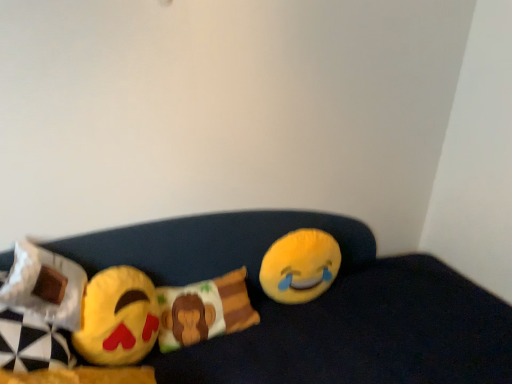
What do you see at coordinates (316, 306) in the screenshot? The image size is (512, 384). I see `yellow plush emoji at center` at bounding box center [316, 306].

What is the approximate height of matte yellow emoji at left, which appears as the 1th toy when viewed from the front?

matte yellow emoji at left, which appears as the 1th toy when viewed from the front, is 9.68 inches in height.

What is the approximate height of yellow plush at right, the 1th toy viewed from the right?

29.37 centimeters.

This screenshot has width=512, height=384. Describe the element at coordinates (204, 310) in the screenshot. I see `fluffy cotton pillow with monkey design at center, which ranks as the second pillow in left-to-right order` at that location.

Where is `white fabric pillow at left, positioned as the second pillow in right-to-left order`? white fabric pillow at left, positioned as the second pillow in right-to-left order is located at coordinates coord(45,285).

At what (x,y) coordinates should I click in order to perform the action: click on yellow plush emoji at center. Please return your answer as a coordinate pair (x, y). The image size is (512, 384). Looking at the image, I should click on (316, 306).

How many degrees apart are the facing directions of matte yellow emoji at left, which is the first toy from left to right, and yellow plush at right, the second toy when ordered from front to back?

The angular difference between matte yellow emoji at left, which is the first toy from left to right, and yellow plush at right, the second toy when ordered from front to back, is 15.2 degrees.

Is matte yellow emoji at left, the 2th toy when ordered from right to left, touching yellow plush at right, the second toy when ordered from front to back?

No, matte yellow emoji at left, the 2th toy when ordered from right to left, is not making contact with yellow plush at right, the second toy when ordered from front to back.

From the image's perspective, which object appears higher, matte yellow emoji at left, acting as the 2th toy starting from the back, or yellow plush at right, positioned as the second toy in left-to-right order?

yellow plush at right, positioned as the second toy in left-to-right order, from the image's perspective.

From a real-world perspective, which is physically below, matte yellow emoji at left, which is the first toy from left to right, or yellow plush at right, the second toy when ordered from front to back?

yellow plush at right, the second toy when ordered from front to back, from a real-world perspective.

Which of these two, yellow plush at right, which ranks as the first toy in back-to-front order, or fluffy cotton pillow with monkey design at center, the 1th pillow when ordered from right to left, is smaller?

yellow plush at right, which ranks as the first toy in back-to-front order, is smaller.

In the scene shown: Relative to fluffy cotton pillow with monkey design at center, placed as the first pillow when sorted from back to front, is yellow plush at right, which ranks as the first toy in back-to-front order, in front or behind?

In the image, yellow plush at right, which ranks as the first toy in back-to-front order, appears behind fluffy cotton pillow with monkey design at center, placed as the first pillow when sorted from back to front.

From the picture: Considering the positions of objects yellow plush at right, which ranks as the first toy in back-to-front order, and fluffy cotton pillow with monkey design at center, placed as the first pillow when sorted from back to front, in the image provided, who is more to the left, yellow plush at right, which ranks as the first toy in back-to-front order, or fluffy cotton pillow with monkey design at center, placed as the first pillow when sorted from back to front,?

Positioned to the left is fluffy cotton pillow with monkey design at center, placed as the first pillow when sorted from back to front.

Which of these two, yellow plush at right, which ranks as the first toy in back-to-front order, or fluffy cotton pillow with monkey design at center, which appears as the second pillow when viewed from the front, is wider?

With larger width is fluffy cotton pillow with monkey design at center, which appears as the second pillow when viewed from the front.

Does matte yellow emoji at left, which is the first toy from left to right, come behind white fabric pillow at left, acting as the second pillow starting from the back?

Yes, matte yellow emoji at left, which is the first toy from left to right, is further from the camera.

How much distance is there between matte yellow emoji at left, which appears as the 1th toy when viewed from the front, and white fabric pillow at left, positioned as the second pillow in right-to-left order?

They are 4.46 inches apart.

Is matte yellow emoji at left, which appears as the 1th toy when viewed from the front, smaller than white fabric pillow at left, the 1th pillow viewed from the front?

Actually, matte yellow emoji at left, which appears as the 1th toy when viewed from the front, might be larger than white fabric pillow at left, the 1th pillow viewed from the front.

From a real-world perspective, is white fabric pillow at left, the first pillow viewed from the left, positioned over yellow plush emoji at center based on gravity?

Yes.

From the picture: Is white fabric pillow at left, the first pillow viewed from the left, not near yellow plush emoji at center?

white fabric pillow at left, the first pillow viewed from the left, is near yellow plush emoji at center, not far away.

Considering the relative sizes of white fabric pillow at left, the 1th pillow viewed from the front, and yellow plush emoji at center in the image provided, is white fabric pillow at left, the 1th pillow viewed from the front, thinner than yellow plush emoji at center?

Yes, white fabric pillow at left, the 1th pillow viewed from the front, is thinner than yellow plush emoji at center.

From the picture: Which is in front, white fabric pillow at left, the 1th pillow viewed from the front, or yellow plush emoji at center?

yellow plush emoji at center is closer to the camera.

From the picture: How much distance is there between white fabric pillow at left, acting as the second pillow starting from the back, and matte yellow emoji at left, the 2th toy when ordered from right to left?

white fabric pillow at left, acting as the second pillow starting from the back, is 4.46 inches away from matte yellow emoji at left, the 2th toy when ordered from right to left.

From the image's perspective, would you say white fabric pillow at left, the first pillow viewed from the left, is shown under matte yellow emoji at left, which appears as the 1th toy when viewed from the front?

Actually, white fabric pillow at left, the first pillow viewed from the left, appears above matte yellow emoji at left, which appears as the 1th toy when viewed from the front, in the image.

Does point (24, 300) come closer to viewer compared to point (111, 353)?

Yes, point (24, 300) is closer to viewer.

Between white fabric pillow at left, the first pillow viewed from the left, and matte yellow emoji at left, the 2th toy when ordered from right to left, which one has less height?

white fabric pillow at left, the first pillow viewed from the left, is shorter.

Is matte yellow emoji at left, acting as the 2th toy starting from the back, taller or shorter than yellow plush emoji at center?

Considering their sizes, matte yellow emoji at left, acting as the 2th toy starting from the back, has less height than yellow plush emoji at center.

You are a GUI agent. You are given a task and a screenshot of the screen. Output one action in this format:
    pyautogui.click(x=<x>, y=<y>)
    Task: Click on the furniture that appears below the matte yellow emoji at left, the 2th toy when ordered from right to left (from a real-world perspective)
    The image size is (512, 384).
    Given the screenshot: What is the action you would take?
    pyautogui.click(x=316, y=306)

Which is behind, point (95, 292) or point (153, 235)?

Positioned behind is point (153, 235).

Is matte yellow emoji at left, which is the first toy from left to right, oriented away from yellow plush emoji at center?

Yes.

Are yellow plush at right, the 1th toy viewed from the right, and matte yellow emoji at left, acting as the 2th toy starting from the back, located far from each other?

yellow plush at right, the 1th toy viewed from the right, is actually quite close to matte yellow emoji at left, acting as the 2th toy starting from the back.

Can matte yellow emoji at left, the 2th toy when ordered from right to left, be found inside yellow plush at right, positioned as the second toy in left-to-right order?

No, matte yellow emoji at left, the 2th toy when ordered from right to left, is located outside of yellow plush at right, positioned as the second toy in left-to-right order.

Between yellow plush at right, positioned as the second toy in left-to-right order, and matte yellow emoji at left, which is the first toy from left to right, which one appears on the left side from the viewer's perspective?

matte yellow emoji at left, which is the first toy from left to right, is more to the left.

From the image's perspective, relative to matte yellow emoji at left, acting as the 2th toy starting from the back, is yellow plush at right, the second toy when ordered from front to back, above or below?

Based on their image positions, yellow plush at right, the second toy when ordered from front to back, is located above matte yellow emoji at left, acting as the 2th toy starting from the back.

The height and width of the screenshot is (384, 512). I want to click on toy below the matte yellow emoji at left, the 2th toy when ordered from right to left (from a real-world perspective), so click(300, 266).

Find the location of a particular element. The image size is (512, 384). toy that is the 2nd object located above the fluffy cotton pillow with monkey design at center, which appears as the second pillow when viewed from the front (from the image's perspective) is located at coordinates click(x=300, y=266).

Which object lies nearer to the anchor point matte yellow emoji at left, acting as the 2th toy starting from the back, yellow plush at right, the second toy when ordered from front to back, or yellow plush emoji at center?

yellow plush emoji at center is positioned closer to the anchor matte yellow emoji at left, acting as the 2th toy starting from the back.

When comparing their distances from yellow plush emoji at center, does white fabric pillow at left, the 1th pillow viewed from the front, or yellow plush at right, which ranks as the first toy in back-to-front order, seem closer?

Based on the image, yellow plush at right, which ranks as the first toy in back-to-front order, appears to be nearer to yellow plush emoji at center.

Estimate the real-world distances between objects in this image. Which object is further from white fabric pillow at left, the first pillow viewed from the left, yellow plush at right, the second toy when ordered from front to back, or fluffy cotton pillow with monkey design at center, the 1th pillow when ordered from right to left?

Based on the image, yellow plush at right, the second toy when ordered from front to back, appears to be further to white fabric pillow at left, the first pillow viewed from the left.

Estimate the real-world distances between objects in this image. Which object is further from yellow plush emoji at center, white fabric pillow at left, positioned as the second pillow in right-to-left order, or fluffy cotton pillow with monkey design at center, which ranks as the second pillow in left-to-right order?

Based on the image, white fabric pillow at left, positioned as the second pillow in right-to-left order, appears to be further to yellow plush emoji at center.

Considering their positions, is matte yellow emoji at left, the 2th toy when ordered from right to left, positioned further to fluffy cotton pillow with monkey design at center, the 1th pillow when ordered from right to left, than yellow plush emoji at center?

Based on the image, yellow plush emoji at center appears to be further to fluffy cotton pillow with monkey design at center, the 1th pillow when ordered from right to left.

Considering their positions, is fluffy cotton pillow with monkey design at center, which ranks as the second pillow in left-to-right order, positioned closer to yellow plush emoji at center than matte yellow emoji at left, which is the first toy from left to right?

fluffy cotton pillow with monkey design at center, which ranks as the second pillow in left-to-right order.

Based on their spatial positions, is matte yellow emoji at left, which appears as the 1th toy when viewed from the front, or white fabric pillow at left, acting as the second pillow starting from the back, closer to yellow plush at right, positioned as the second toy in left-to-right order?

Among the two, matte yellow emoji at left, which appears as the 1th toy when viewed from the front, is located nearer to yellow plush at right, positioned as the second toy in left-to-right order.

From the image, which object appears to be farther from white fabric pillow at left, the 1th pillow viewed from the front, matte yellow emoji at left, which appears as the 1th toy when viewed from the front, or yellow plush at right, the 1th toy viewed from the right?

yellow plush at right, the 1th toy viewed from the right, lies further to white fabric pillow at left, the 1th pillow viewed from the front, than the other object.

Identify the location of toy between yellow plush emoji at center and fluffy cotton pillow with monkey design at center, the 1th pillow when ordered from right to left, along the z-axis. Image resolution: width=512 pixels, height=384 pixels. (118, 318).

Identify the location of toy situated between white fabric pillow at left, the 1th pillow viewed from the front, and yellow plush at right, the second toy when ordered from front to back, from left to right. pos(118,318).

You are a GUI agent. You are given a task and a screenshot of the screen. Output one action in this format:
    pyautogui.click(x=<x>, y=<y>)
    Task: Click on the pillow between white fabric pillow at left, acting as the second pillow starting from the back, and yellow plush at right, which ranks as the first toy in back-to-front order, in the horizontal direction
    
    Given the screenshot: What is the action you would take?
    pyautogui.click(x=204, y=310)

The height and width of the screenshot is (384, 512). In order to click on toy located between white fabric pillow at left, the 1th pillow viewed from the front, and yellow plush emoji at center in the left-right direction in this screenshot , I will do `click(118, 318)`.